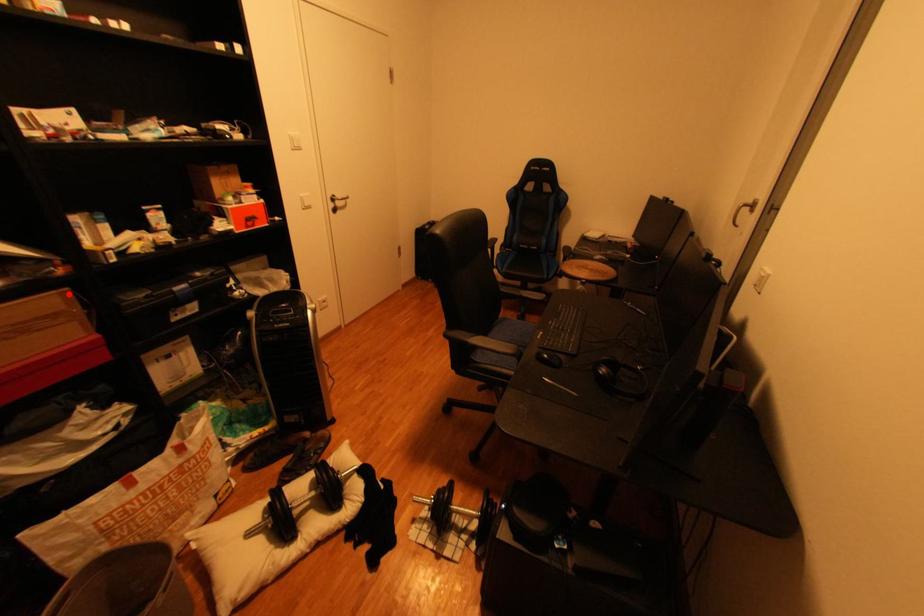
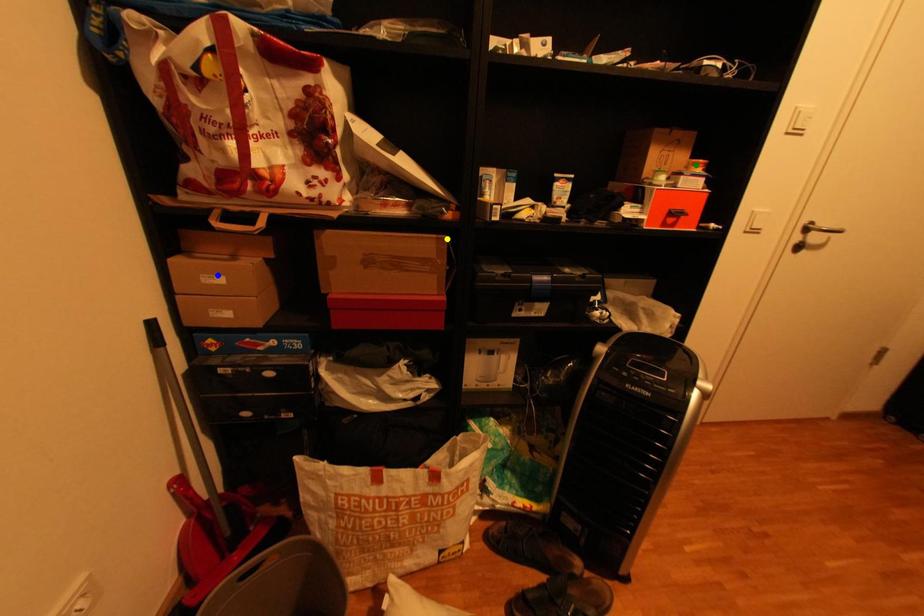
Question: I am providing you with two images of the same scene from different viewpoints. A red point is marked on the first image. You are given multiple points on the second image. Which spot in image 2 lines up with the point in image 1?

Choices:
 (A) yellow point
 (B) green point
 (C) blue point

Answer: (A)